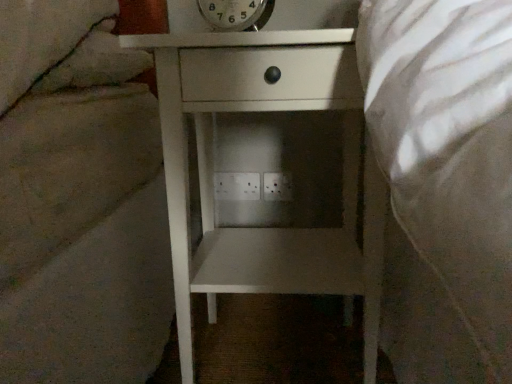
At what (x,y) coordinates should I click in order to perform the action: click on free point below white matte nightstand at center (from a real-world perspective). Please return your answer as a coordinate pair (x, y). Looking at the image, I should click on (267, 350).